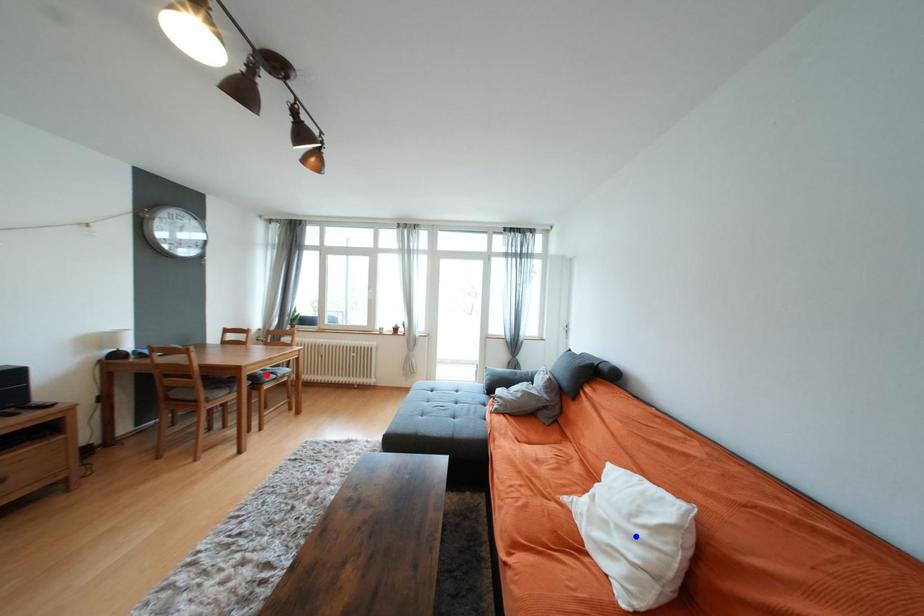
Question: Which of the two points in the image is closer to the camera?

Choices:
 (A) Blue point is closer.
 (B) Red point is closer.

Answer: (A)